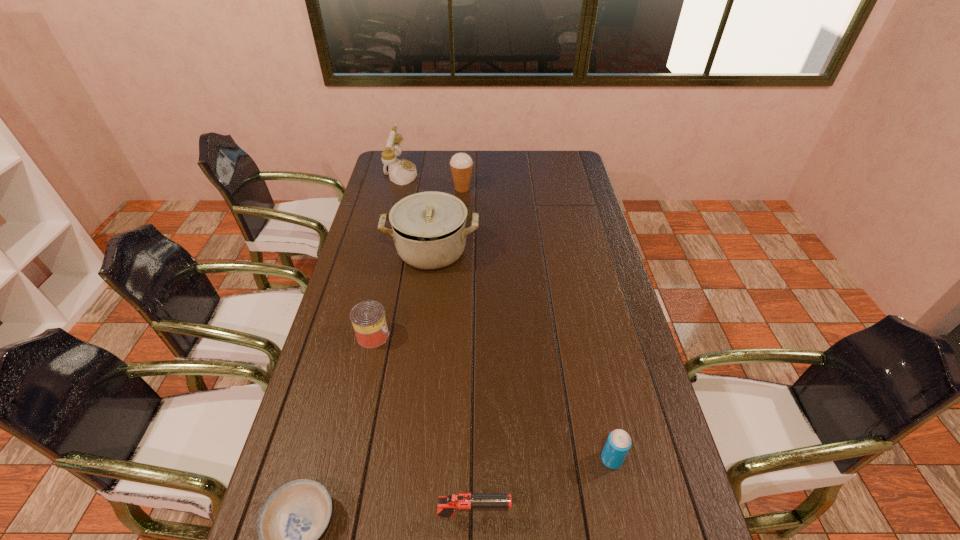
Locate an element on the screen. This screenshot has width=960, height=540. free point located on the back of the soda can is located at coordinates (597, 392).

Where is `blank area located 0.180m on the right of the can`? blank area located 0.180m on the right of the can is located at coordinates (448, 336).

The image size is (960, 540). I want to click on free space located at the aiming end of the gun, so click(595, 515).

Find the location of `object positioned at the far edge`. object positioned at the far edge is located at coordinates (401, 172).

Find the location of a particular element. The height and width of the screenshot is (540, 960). telephone at the left edge is located at coordinates pos(401,172).

At what (x,y) coordinates should I click in order to perform the action: click on saucepan that is positioned at the left edge. Please return your answer as a coordinate pair (x, y). Looking at the image, I should click on (429, 230).

The height and width of the screenshot is (540, 960). What are the coordinates of `can present at the left edge` in the screenshot? It's located at (368, 318).

Find the location of `object present at the right edge`. object present at the right edge is located at coordinates (618, 443).

Find the location of a particular element. This screenshot has width=960, height=540. object that is at the far left corner is located at coordinates (401, 172).

The width and height of the screenshot is (960, 540). I want to click on vacant space at the far edge, so click(501, 156).